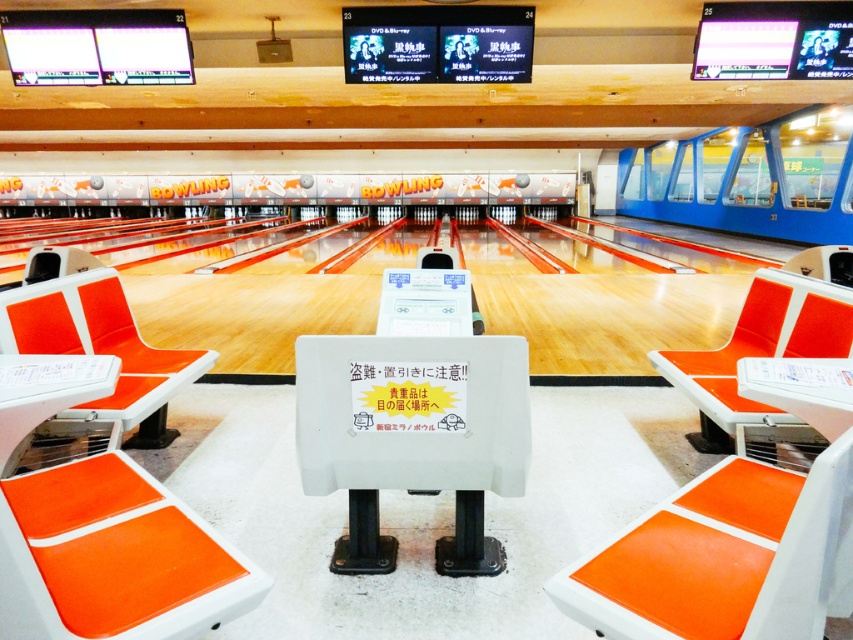
Question: Does orange plastic chair at lower left have a lesser width compared to orange matte seat at center?

Choices:
 (A) yes
 (B) no

Answer: (B)

Question: Based on their relative distances, which object is farther from the orange plastic chair at center?

Choices:
 (A) orange matte seat at center
 (B) orange plastic chair at left

Answer: (B)

Question: Which point is closer to the camera?

Choices:
 (A) orange plastic chair at left
 (B) orange plastic chair at center
 (C) orange matte seat at center
 (D) orange plastic chair at lower left

Answer: (C)

Question: Does orange plastic chair at lower left appear under orange plastic chair at left?

Choices:
 (A) no
 (B) yes

Answer: (B)

Question: Is orange plastic chair at lower left positioned at the back of orange matte seat at center?

Choices:
 (A) yes
 (B) no

Answer: (A)

Question: Which of the following is the farthest from the observer?

Choices:
 (A) (134, 362)
 (B) (128, 588)
 (C) (692, 504)
 (D) (708, 355)

Answer: (D)